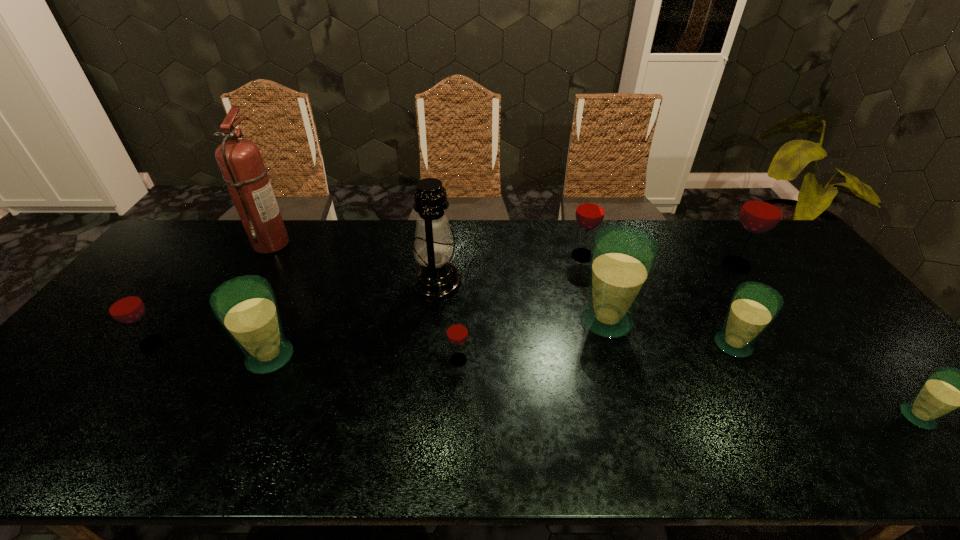
Where is `free space between the leftmost red glass and the third blue glass from right to left`? free space between the leftmost red glass and the third blue glass from right to left is located at coordinates (379, 332).

The height and width of the screenshot is (540, 960). I want to click on free space between the smallest red glass and the leftmost object, so click(305, 352).

I want to click on free point between the biggest blue glass and the third object from right to left, so click(669, 333).

Locate an element on the screen. The width and height of the screenshot is (960, 540). vacant space that's between the seventh glass from left to right and the fire extinguisher is located at coordinates (504, 254).

Identify the location of free spot between the fire extinguisher and the third glass from right to left. The image size is (960, 540). (502, 294).

This screenshot has width=960, height=540. What are the coordinates of `vacant region between the sixth glass from left to right and the third smallest red glass` in the screenshot? It's located at (658, 300).

I want to click on the sixth closest object to the second object from right to left, so click(457, 331).

Locate which object ranks third in proximity to the biggest blue glass. Please provide its 2D coordinates. Your answer should be formatted as a tuple, i.e. [(x, y)], where the tuple contains the x and y coordinates of a point satisfying the conditions above.

[(457, 331)]

Locate an element on the screen. glass that is the sixth closest one to the third blue glass from right to left is located at coordinates (246, 307).

Locate which glass ranks second in proximity to the nearest object. Please provide its 2D coordinates. Your answer should be formatted as a tuple, i.e. [(x, y)], where the tuple contains the x and y coordinates of a point satisfying the conditions above.

[(762, 210)]